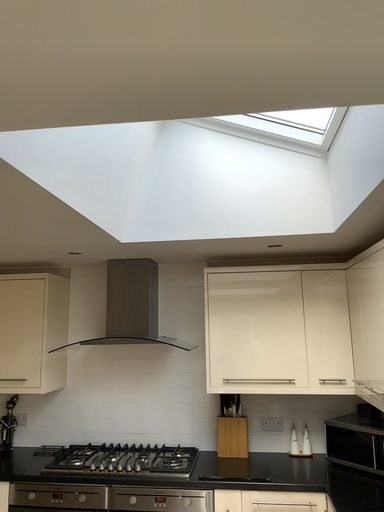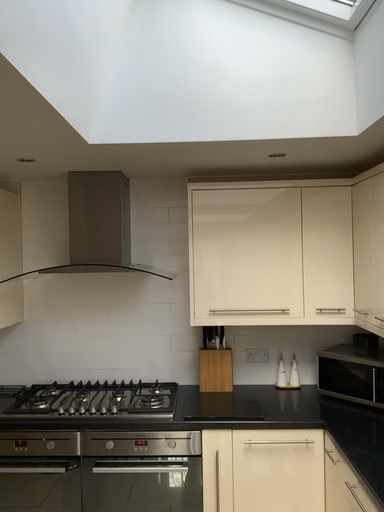
Question: Which way did the camera rotate in the video?

Choices:
 (A) rotated downward
 (B) rotated upward

Answer: (A)